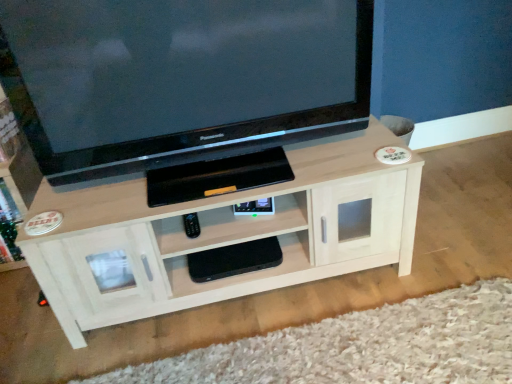
Question: Relative to white wood tv cabinet at lower left, is light wood shelf at center, marked as the second shelf in a bottom-to-top arrangement, in front or behind?

Choices:
 (A) behind
 (B) front

Answer: (B)

Question: From the image's perspective, is light wood shelf at center, which appears as the 1th shelf when viewed from the top, positioned above or below white wood tv cabinet at lower left?

Choices:
 (A) below
 (B) above

Answer: (A)

Question: Which object is positioned farthest from the light wood shelf at center, marked as the second shelf in a bottom-to-top arrangement?

Choices:
 (A) white wood tv cabinet at lower left
 (B) black matte gaming console at center, the 1th shelf positioned from the bottom
 (C) black glossy television at upper center

Answer: (A)

Question: Which object is positioned closest to the light wood shelf at center, which appears as the 1th shelf when viewed from the top?

Choices:
 (A) white wood tv cabinet at lower left
 (B) black matte gaming console at center, the 1th shelf positioned from the bottom
 (C) black glossy television at upper center

Answer: (B)